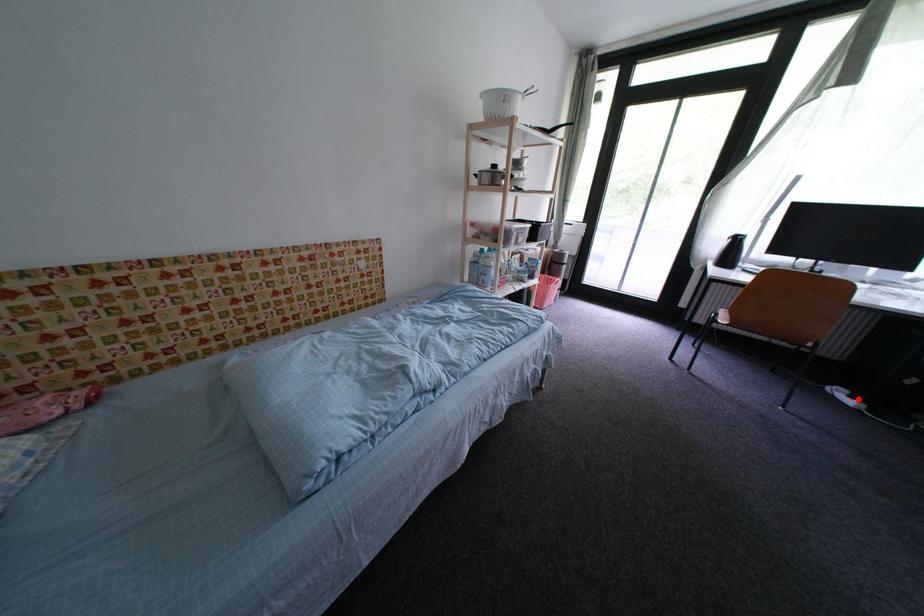
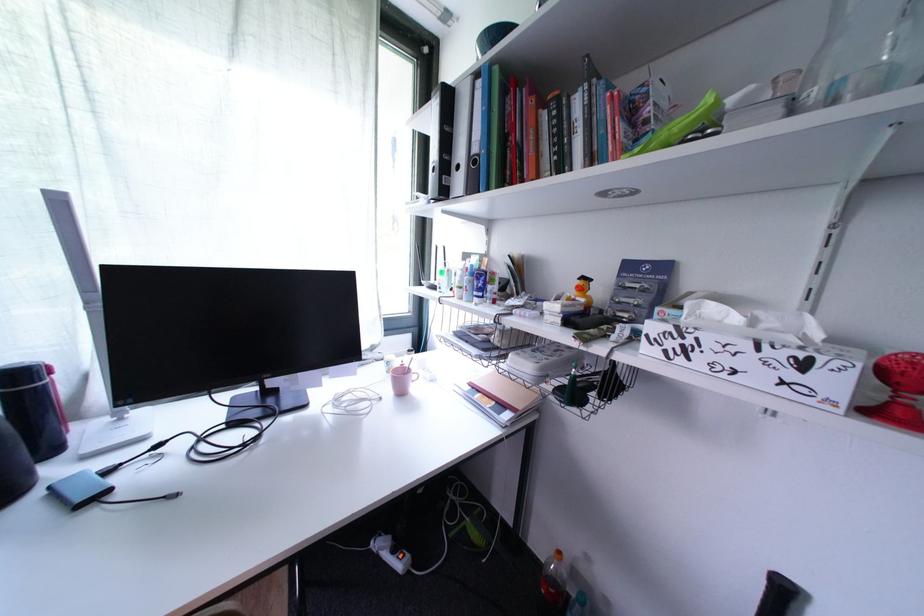
Question: I am providing you with two images of the same scene from different viewpoints. In image1, a red point is highlighted. Considering the same 3D point in image2, which of the following is correct?

Choices:
 (A) It is closer
 (B) It is farther

Answer: (A)